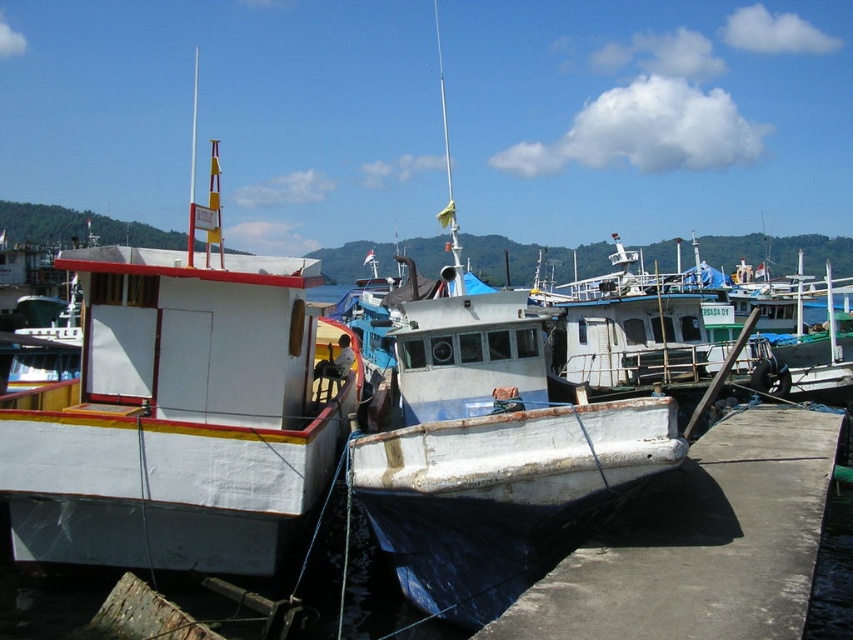
Question: Which point is closer to the camera?

Choices:
 (A) white matte boat at left
 (B) white concrete dock at lower right

Answer: (B)

Question: Among these points, which one is nearest to the camera?

Choices:
 (A) (440, 364)
 (B) (111, 465)

Answer: (B)

Question: Which point is farther from the camera taking this photo?

Choices:
 (A) (221, 365)
 (B) (526, 548)
 (C) (659, 628)

Answer: (A)

Question: Does white matte boat at left have a greater width compared to white matte boat at center?

Choices:
 (A) no
 (B) yes

Answer: (B)

Question: Is white matte boat at left positioned behind white matte boat at center?

Choices:
 (A) yes
 (B) no

Answer: (A)

Question: Can you confirm if white matte boat at center is positioned below white concrete dock at lower right?

Choices:
 (A) no
 (B) yes

Answer: (A)